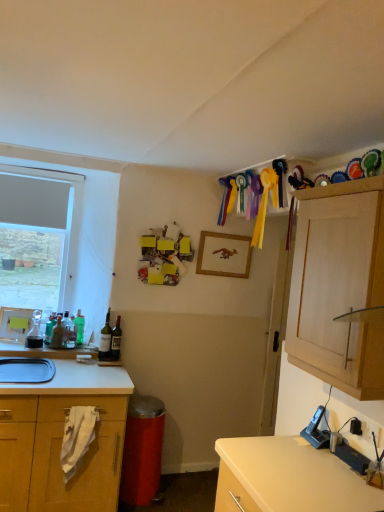
Describe the element at coordinates (316, 430) in the screenshot. This screenshot has width=384, height=512. I see `black plastic phone at lower right` at that location.

Locate an element on the screen. wooden frame at center, acting as the 2th picture frame starting from the bottom is located at coordinates (224, 255).

Measure the distance between point [100,344] and camera.

Point [100,344] is 2.96 meters away from camera.

The width and height of the screenshot is (384, 512). What are the coordinates of `light wood cabinet at upper right` in the screenshot? It's located at (x=338, y=286).

Identify the location of matte white sink at lower left. (26, 370).

What do you see at coordinates (116, 340) in the screenshot? I see `dark brown glass bottle at left, the first bottle when ordered from right to left` at bounding box center [116, 340].

Find the location of a particular element. Image resolution: width=384 pixels, height=512 pixels. black plastic phone at lower right is located at coordinates (316, 430).

Is matte silver picture frame at left, the 1th picture frame when ordered from left to right, bigger than green matte bottle at left, which is counted as the fourth bottle, starting from the left?

Indeed, matte silver picture frame at left, the 1th picture frame when ordered from left to right, has a larger size compared to green matte bottle at left, which is counted as the fourth bottle, starting from the left.

Which object is thinner, matte silver picture frame at left, the second picture frame when ordered from top to bottom, or green matte bottle at left, which is counted as the fourth bottle, starting from the left?

matte silver picture frame at left, the second picture frame when ordered from top to bottom, is thinner.

From a real-world perspective, who is located lower, matte silver picture frame at left, which ranks as the second picture frame in right-to-left order, or green matte bottle at left, which is counted as the fourth bottle, starting from the left?

In real-world perspective, matte silver picture frame at left, which ranks as the second picture frame in right-to-left order, is lower.

Is light wood cabinet at upper right not near wooden frame at center, placed as the 1th picture frame when sorted from right to left?

light wood cabinet at upper right is far away from wooden frame at center, placed as the 1th picture frame when sorted from right to left.

Is wooden frame at center, arranged as the 2th picture frame when viewed from the front, at the back of light wood cabinet at upper right?

No, light wood cabinet at upper right's orientation is not away from wooden frame at center, arranged as the 2th picture frame when viewed from the front.

Does point (366, 361) appear closer or farther from the camera than point (218, 237)?

Point (366, 361).

How distant is light wood cabinet at upper right from wooden frame at center, acting as the 2th picture frame starting from the bottom?

The distance of light wood cabinet at upper right from wooden frame at center, acting as the 2th picture frame starting from the bottom, is 5.01 feet.

There is a white laminate countertop at lower left. Identify the location of the 3rd bottle above it (from the image's perspective). (57, 334).

What's the angular difference between white laminate countertop at lower left and translucent glass bottle at left, which is the 2th bottle from left to right,'s facing directions?

The facing directions of white laminate countertop at lower left and translucent glass bottle at left, which is the 2th bottle from left to right, are 4.59 degrees apart.

Is white laminate countertop at lower left aimed at translucent glass bottle at left, the 5th bottle viewed from the right?

No, white laminate countertop at lower left is not aimed at translucent glass bottle at left, the 5th bottle viewed from the right.

From a real-world perspective, relative to translucent glass bottle at left, the 5th bottle viewed from the right, is white laminate countertop at lower left vertically above or below?

In terms of real-world spatial position, white laminate countertop at lower left is below translucent glass bottle at left, the 5th bottle viewed from the right.

Is light wood cabinet at upper right at the right side of matte silver picture frame at left, the 1th picture frame when ordered from left to right?

Yes.

Is light wood cabinet at upper right inside the boundaries of matte silver picture frame at left, positioned as the second picture frame in back-to-front order, or outside?

light wood cabinet at upper right exists outside the volume of matte silver picture frame at left, positioned as the second picture frame in back-to-front order.

Between light wood cabinet at upper right and matte silver picture frame at left, the 1th picture frame when ordered from left to right, which one has smaller size?

With smaller size is matte silver picture frame at left, the 1th picture frame when ordered from left to right.

Considering the sizes of objects light wood cabinet at upper right and matte silver picture frame at left, the second picture frame when ordered from top to bottom, in the image provided, who is thinner, light wood cabinet at upper right or matte silver picture frame at left, the second picture frame when ordered from top to bottom,?

matte silver picture frame at left, the second picture frame when ordered from top to bottom, is thinner.

Is translucent glass bottle at left, the 5th bottle viewed from the right, bigger than translucent glass bottle at left, which is the third bottle from left to right?

Correct, translucent glass bottle at left, the 5th bottle viewed from the right, is larger in size than translucent glass bottle at left, which is the third bottle from left to right.

From the image's perspective, is translucent glass bottle at left, the 5th bottle viewed from the right, on translucent glass bottle at left, which is the third bottle from left to right?

No, from the image's perspective, translucent glass bottle at left, the 5th bottle viewed from the right, is not on top of translucent glass bottle at left, which is the third bottle from left to right.

This screenshot has height=512, width=384. In order to click on the 1st bottle counting from the right side of the translucent glass bottle at left, the 5th bottle viewed from the right in this screenshot , I will do `click(67, 331)`.

Is point (58, 336) closer to viewer compared to point (65, 328)?

Yes, point (58, 336) is in front of point (65, 328).

Between green matte bottle at left, which is counted as the third bottle, starting from the right, and black plastic phone at lower right, which one has larger size?

With larger size is black plastic phone at lower right.

Is green matte bottle at left, which is counted as the fourth bottle, starting from the left, with black plastic phone at lower right?

green matte bottle at left, which is counted as the fourth bottle, starting from the left, and black plastic phone at lower right are clearly separated.

Is green matte bottle at left, which is counted as the fourth bottle, starting from the left, facing away from black plastic phone at lower right?

No, green matte bottle at left, which is counted as the fourth bottle, starting from the left, is not facing away from black plastic phone at lower right.

Where is `appliance below the green matte bottle at left, which is counted as the third bottle, starting from the right (from a real-world perspective)`? The width and height of the screenshot is (384, 512). appliance below the green matte bottle at left, which is counted as the third bottle, starting from the right (from a real-world perspective) is located at coordinates (316, 430).

From the image's perspective, would you say translucent glass bottle at left, which is the third bottle from left to right, is shown under black plastic phone at lower right?

No, from the image's perspective, translucent glass bottle at left, which is the third bottle from left to right, is not beneath black plastic phone at lower right.

Which is in front, translucent glass bottle at left, which is the third bottle from left to right, or black plastic phone at lower right?

black plastic phone at lower right is in front.

Does translucent glass bottle at left, acting as the fourth bottle starting from the right, have a greater height compared to black plastic phone at lower right?

Indeed, translucent glass bottle at left, acting as the fourth bottle starting from the right, has a greater height compared to black plastic phone at lower right.

Is translucent glass bottle at left, acting as the fourth bottle starting from the right, placed right next to black plastic phone at lower right?

translucent glass bottle at left, acting as the fourth bottle starting from the right, and black plastic phone at lower right are clearly separated.

Where is `bottle that is the 2nd one when counting downward from the matte silver picture frame at left, acting as the first picture frame starting from the front (from the image's perspective)`? The width and height of the screenshot is (384, 512). bottle that is the 2nd one when counting downward from the matte silver picture frame at left, acting as the first picture frame starting from the front (from the image's perspective) is located at coordinates (79, 327).

Find the location of a particular element. The height and width of the screenshot is (512, 384). cabinetry below the wooden frame at center, the first picture frame viewed from the back (from a real-world perspective) is located at coordinates (338, 286).

When comparing their distances from matte glass bottle at center left, the 2th bottle from the right, does green matte bottle at left, which is counted as the third bottle, starting from the right, or white laminate countertop at lower left seem closer?

green matte bottle at left, which is counted as the third bottle, starting from the right, is closer to matte glass bottle at center left, the 2th bottle from the right.

Which object lies further to the anchor point light wood cabinet at upper right, translucent glass bottle at left, the 5th bottle viewed from the right, or black plastic phone at lower right?

The object further to light wood cabinet at upper right is translucent glass bottle at left, the 5th bottle viewed from the right.

Considering their positions, is white laminate countertop at lower left positioned closer to black plastic phone at lower right than matte silver picture frame at left, acting as the first picture frame starting from the front?

The object closer to black plastic phone at lower right is white laminate countertop at lower left.

Considering their positions, is matte silver picture frame at left, which ranks as the second picture frame in right-to-left order, positioned closer to light wood cabinet at upper right than white laminate countertop at lower left?

white laminate countertop at lower left is closer to light wood cabinet at upper right.

From the picture: Based on their spatial positions, is translucent glass bottle at left, acting as the fourth bottle starting from the right, or white laminate countertop at lower left closer to matte silver picture frame at left, arranged as the 1th picture frame when ordered from the bottom?

white laminate countertop at lower left is positioned closer to the anchor matte silver picture frame at left, arranged as the 1th picture frame when ordered from the bottom.

Based on their spatial positions, is translucent glass bottle at left, the 5th bottle viewed from the right, or light wood cabinet at upper right closer to black plastic phone at lower right?

The object closer to black plastic phone at lower right is light wood cabinet at upper right.

Which object lies further to the anchor point translucent glass carafe at left, arranged as the 6th bottle when viewed from the right, translucent glass bottle at left, which is the 2th bottle from left to right, or dark brown glass bottle at left, the first bottle when ordered from right to left?

dark brown glass bottle at left, the first bottle when ordered from right to left, is positioned further to the anchor translucent glass carafe at left, arranged as the 6th bottle when viewed from the right.

Based on their spatial positions, is translucent glass carafe at left, arranged as the first bottle when viewed from the left, or white laminate countertop at lower left closer to black plastic phone at lower right?

white laminate countertop at lower left is positioned closer to the anchor black plastic phone at lower right.

In order to click on appliance between translucent glass bottle at left, which is the 2th bottle from left to right, and light wood cabinet at upper right from left to right in this screenshot , I will do `click(316, 430)`.

Locate an element on the screen. Image resolution: width=384 pixels, height=512 pixels. picture frame located between green matte bottle at left, which is counted as the third bottle, starting from the right, and black plastic phone at lower right in the left-right direction is located at coordinates (224, 255).

What are the coordinates of `countertop between matte silver picture frame at left, arranged as the 1th picture frame when ordered from the bottom, and black plastic phone at lower right from left to right` in the screenshot? It's located at (44, 351).

The image size is (384, 512). I want to click on countertop situated between matte silver picture frame at left, arranged as the 1th picture frame when ordered from the bottom, and translucent glass bottle at left, acting as the fourth bottle starting from the right, from left to right, so click(x=44, y=351).